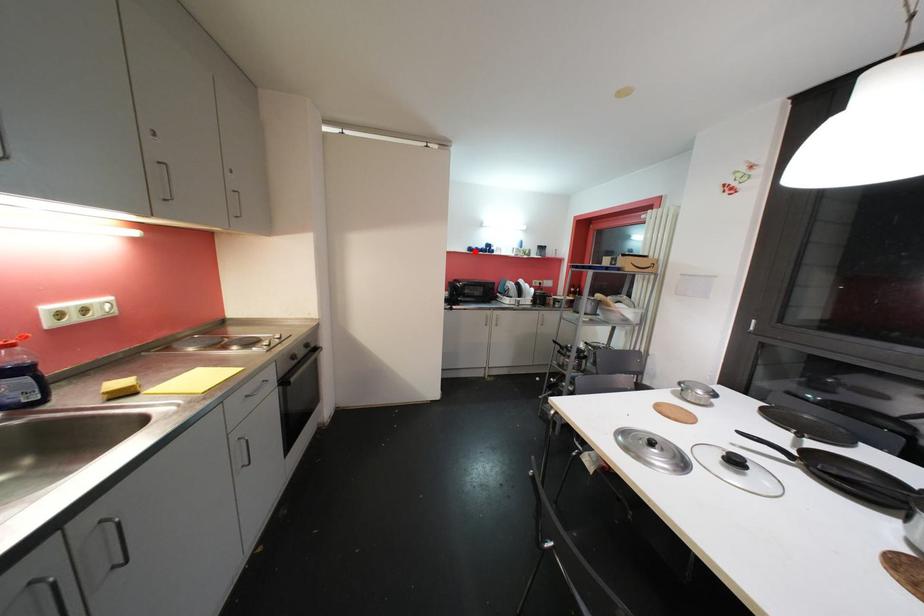
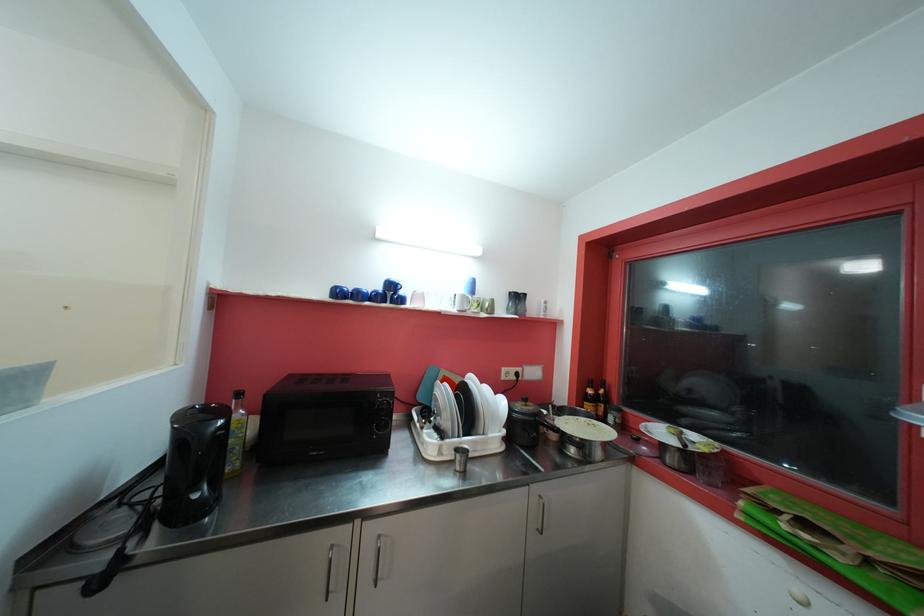
Locate, in the second image, the point that corresponds to the highlighted location in the first image.

(343, 294)